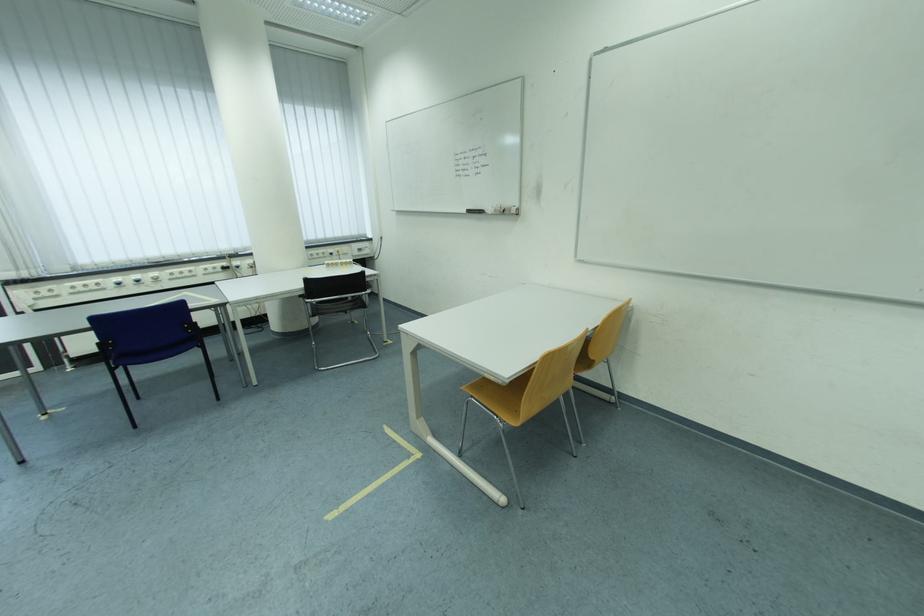
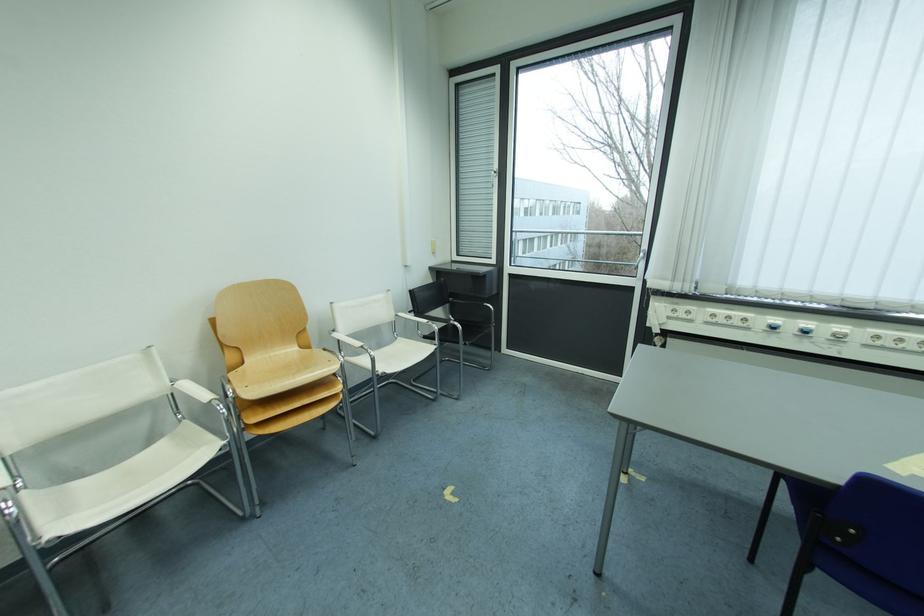
In the second image, find the point that corresponds to [93,288] in the first image.

(737, 320)